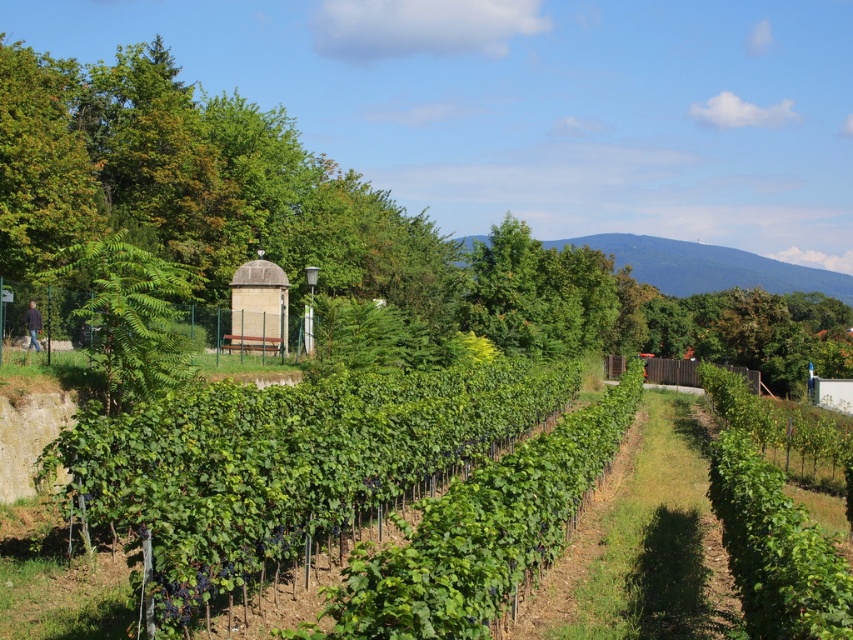
You are a landscape architect designing a walking path between the green leafy hedge at center and the green leafy tree at left. What is the minimum width required for the path to ensure visitors can comfortably walk between them?

The green leafy hedge at center is 5.83 meters from the green leafy tree at left, so the path should be at least 5.83 meters wide to allow visitors to comfortably walk between them.